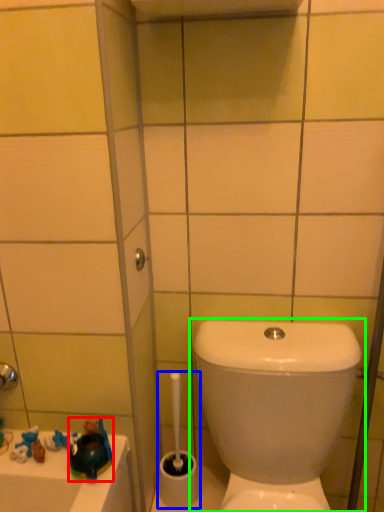
Question: Which object is the farthest from toy (highlighted by a red box)? Choose among these: brush (highlighted by a blue box) or toilet (highlighted by a green box).

Choices:
 (A) brush
 (B) toilet

Answer: (B)